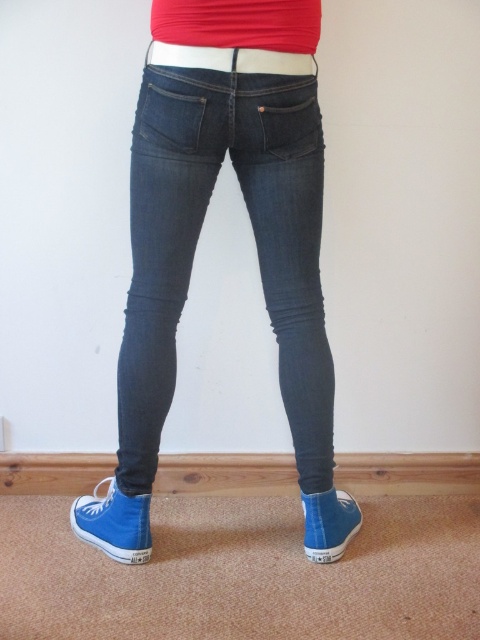
Between dark blue denim jeans at center and white fabric belt at center, which one appears on the right side from the viewer's perspective?

From the viewer's perspective, white fabric belt at center appears more on the right side.

Does point (175, 205) come farther from viewer compared to point (308, 58)?

Yes, it is behind point (308, 58).

Is point (237, 163) in front of point (188, 60)?

No, it is not.

The height and width of the screenshot is (640, 480). Identify the location of dark blue denim jeans at center. (197, 237).